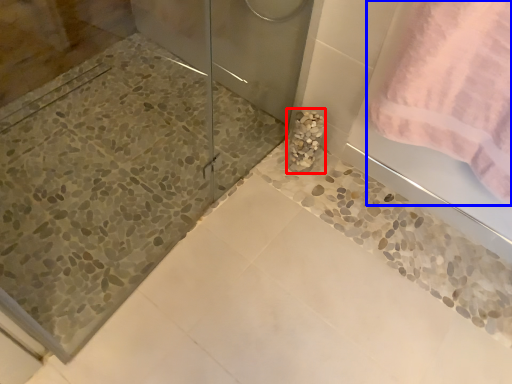
Question: Which object appears farthest to the camera in this image, marble (highlighted by a red box) or towel (highlighted by a blue box)?

Choices:
 (A) marble
 (B) towel

Answer: (A)